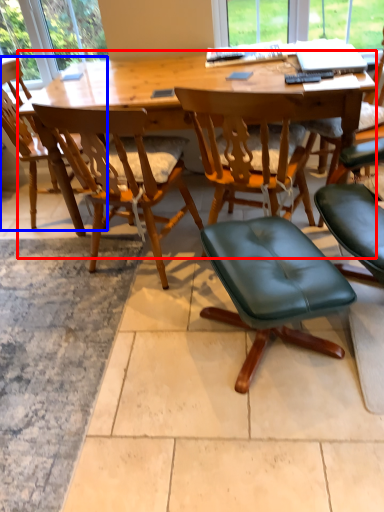
Question: Which object is further to the camera taking this photo, desk (highlighted by a red box) or chair (highlighted by a blue box)?

Choices:
 (A) desk
 (B) chair

Answer: (B)